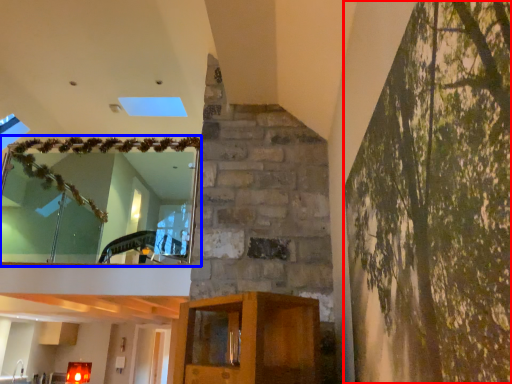
Question: Which object is closer to the camera taking this photo, tree (highlighted by a red box) or window (highlighted by a blue box)?

Choices:
 (A) tree
 (B) window

Answer: (A)